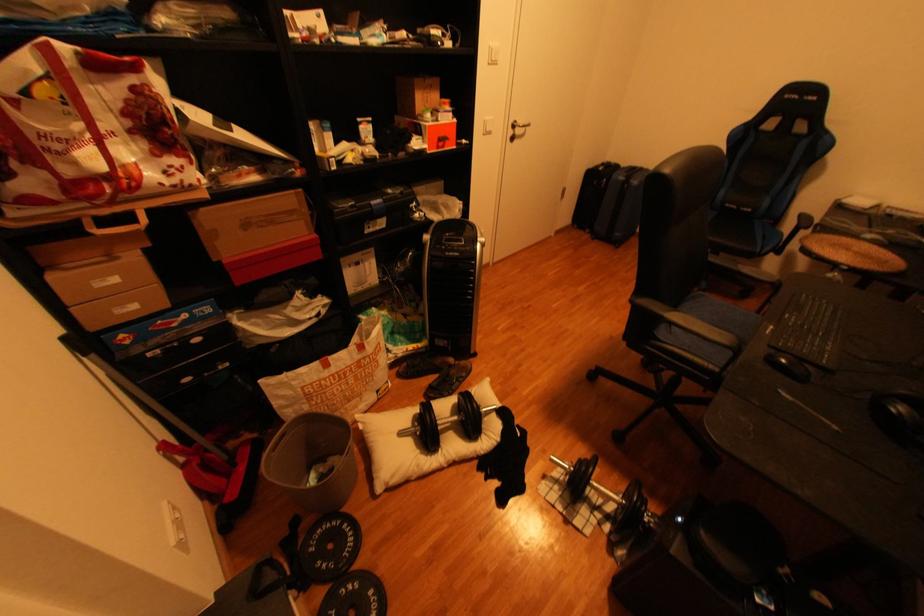
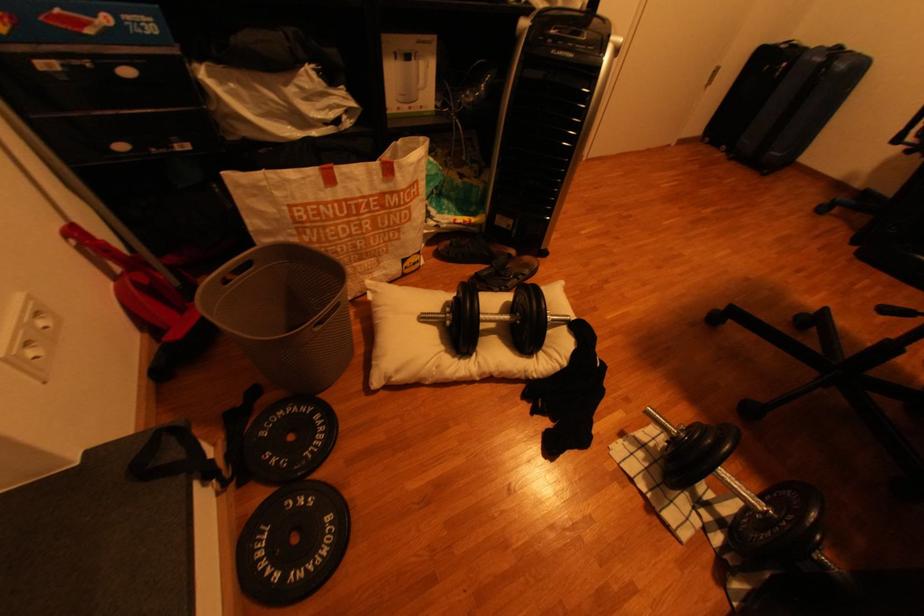
Locate, in the second image, the point that corresponds to the point at 354,527 in the first image.

(325, 419)